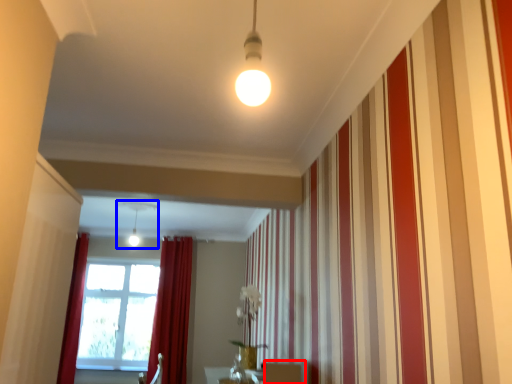
Question: Which of the following is the farthest to the observer, furniture (highlighted by a red box) or light fixture (highlighted by a blue box)?

Choices:
 (A) furniture
 (B) light fixture

Answer: (B)